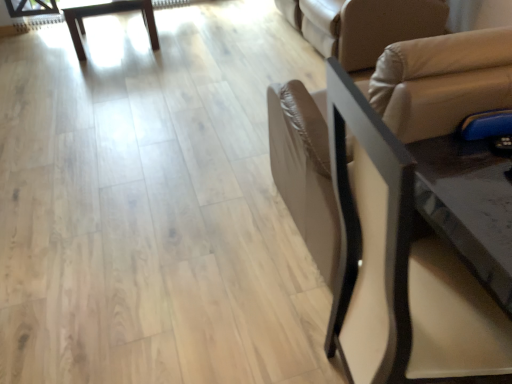
Question: Relative to black leather chair at right, is beige leather futon at upper right in front or behind?

Choices:
 (A) front
 (B) behind

Answer: (B)

Question: Considering the positions of beige leather futon at upper right and black leather chair at right in the image, is beige leather futon at upper right wider or thinner than black leather chair at right?

Choices:
 (A) wide
 (B) thin

Answer: (A)

Question: Estimate the real-world distances between objects in this image. Which object is closer to the wooden table at upper left?

Choices:
 (A) beige leather futon at upper right
 (B) black leather chair at right

Answer: (A)

Question: Estimate the real-world distances between objects in this image. Which object is farther from the wooden table at upper left?

Choices:
 (A) black leather chair at right
 (B) beige leather futon at upper right

Answer: (A)